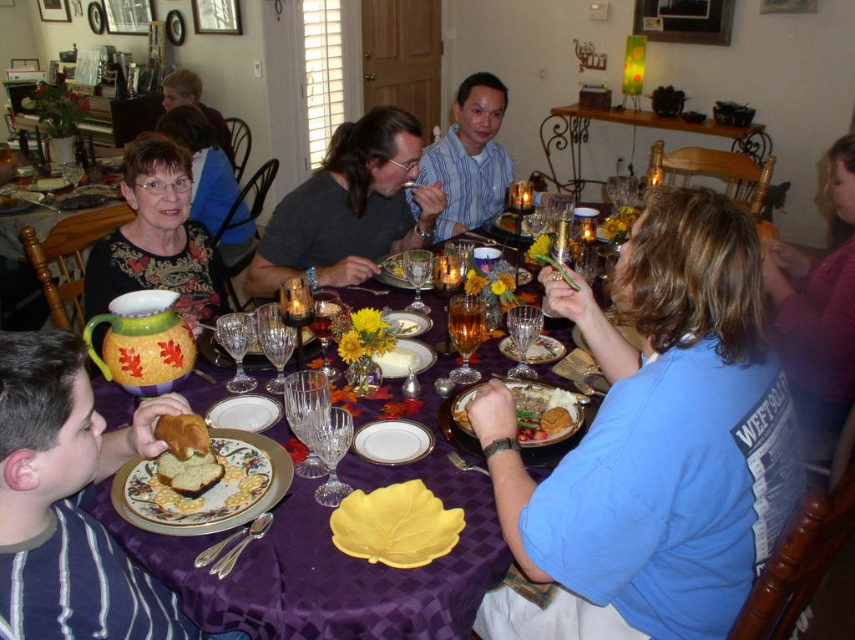
Is point (213, 433) more distant than point (207, 109)?

No, it is in front of (207, 109).

Does decorative ceramic plate at lower left have a greater height compared to matte blue shirt at upper left?

No.

Which is in front, point (219, 512) or point (183, 84)?

Point (219, 512) is in front.

Locate an element on the screen. decorative ceramic plate at lower left is located at coordinates (209, 490).

Image resolution: width=855 pixels, height=640 pixels. Describe the element at coordinates (653, 444) in the screenshot. I see `blue cotton shirt at center` at that location.

Is point (540, 522) more distant than point (190, 472)?

No, (540, 522) is in front of (190, 472).

Locate an element on the screen. This screenshot has width=855, height=640. blue cotton shirt at center is located at coordinates (653, 444).

Which of these two, blue cotton shirt at center or decorative ceramic plate at lower left, stands shorter?

Standing shorter between the two is decorative ceramic plate at lower left.

Can you confirm if blue cotton shirt at center is taller than decorative ceramic plate at lower left?

Correct, blue cotton shirt at center is much taller as decorative ceramic plate at lower left.

Is point (481, 404) positioned behind point (246, 452)?

No.

This screenshot has width=855, height=640. What are the coordinates of `blue cotton shirt at center` in the screenshot? It's located at pos(653,444).